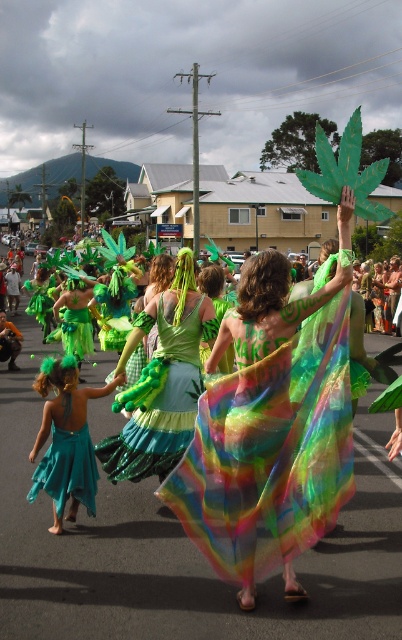
Is green satin dress at center taller than teal satin skirt at lower left?

Correct, green satin dress at center is much taller as teal satin skirt at lower left.

Which is below, green satin dress at center or teal satin skirt at lower left?

teal satin skirt at lower left

Does point (159, 408) lie behind point (71, 472)?

That is True.

Identify the location of green satin dress at center. The image size is (402, 640). (160, 381).

Who is higher up, rainbow tulle dress at center or green satin dress at center?

green satin dress at center is higher up.

Based on the photo, does rainbow tulle dress at center come in front of green satin dress at center?

Yes, rainbow tulle dress at center is closer to the viewer.

Is point (387, 572) positioned behind point (166, 416)?

No.

Locate an element on the screen. Image resolution: width=402 pixels, height=640 pixels. rainbow tulle dress at center is located at coordinates (178, 545).

Between point (260, 264) and point (59, 508), which one is positioned in front?

Point (260, 264) is more forward.

Which of these two, rainbow sheer fabric at center or teal satin skirt at lower left, stands taller?

With more height is rainbow sheer fabric at center.

Is point (328, 291) positioned after point (80, 451)?

No, (328, 291) is closer to viewer.

Image resolution: width=402 pixels, height=640 pixels. Find the location of `rainbow sheer fabric at center`. rainbow sheer fabric at center is located at coordinates (270, 428).